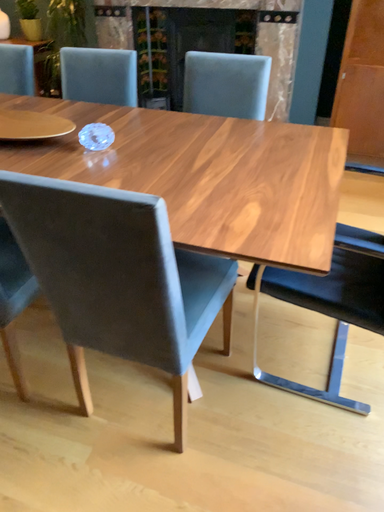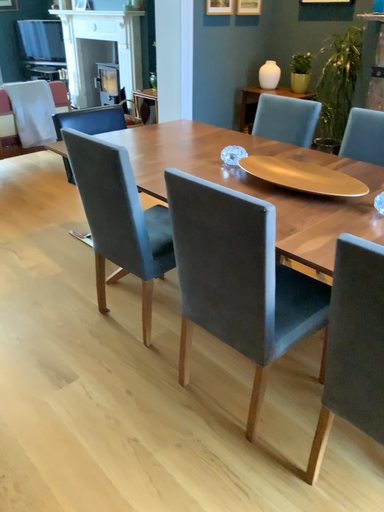
Question: Which way did the camera rotate in the video?

Choices:
 (A) rotated downward
 (B) rotated upward

Answer: (B)